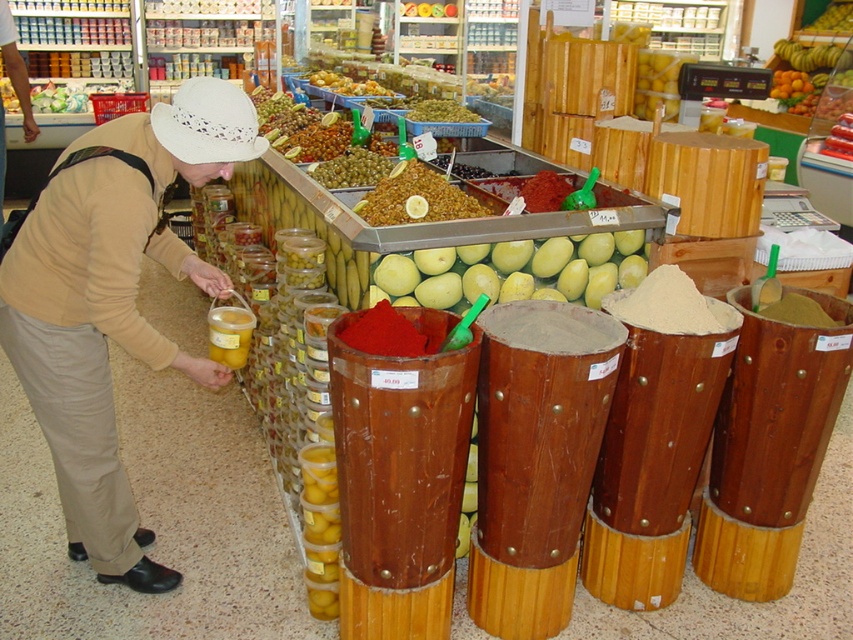
You are a customer looking at the yellow smooth mango at center and the green matte olives at center. Which item is positioned lower on the counter?

The yellow smooth mango at center is positioned below the green matte olives at center, so it is lower.

You are a customer browsing the market and want to see both the beige sweater at center and the green matte olives at center. Which item is closer to you?

The beige sweater at center is closer to you because it is in front of the green matte olives at center.